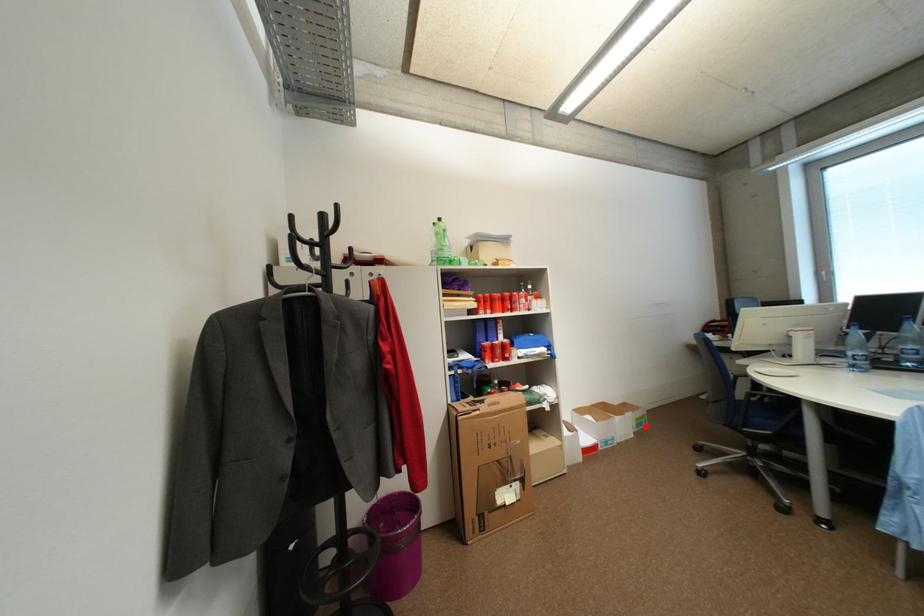
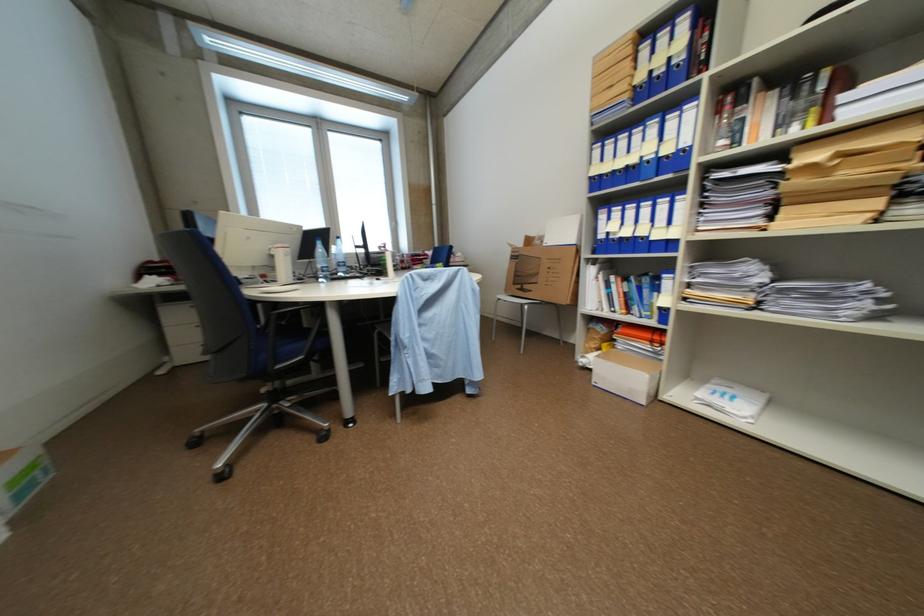
Find the pixel in the second image that matches the highlighted location in the first image.

(28, 496)